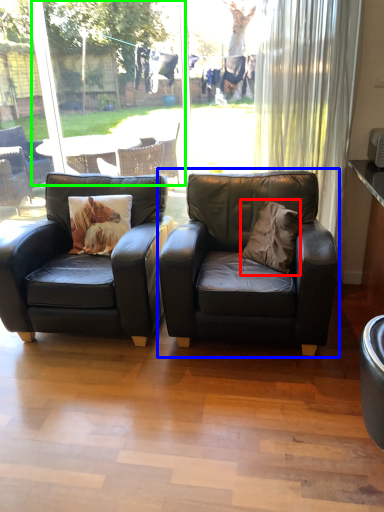
Question: Which object is positioned farthest from throw pillow (highlighted by a red box)? Select from chair (highlighted by a blue box) and window screen (highlighted by a green box).

Choices:
 (A) chair
 (B) window screen

Answer: (B)